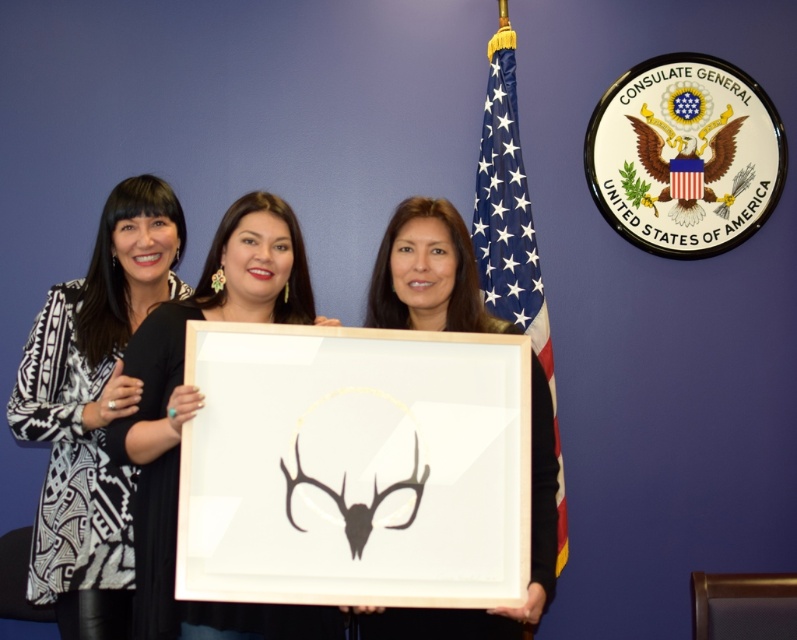
Question: Which point is closer to the camera?

Choices:
 (A) black matte deer head at center
 (B) american flag at center

Answer: (A)

Question: Is black printed fabric at left wider than matte black frame at center?

Choices:
 (A) yes
 (B) no

Answer: (A)

Question: Observing the image, what is the correct spatial positioning of matte black frame at center in reference to black matte deer head at center?

Choices:
 (A) below
 (B) above

Answer: (B)

Question: Which object is positioned closest to the black printed fabric at left?

Choices:
 (A) american flag at center
 (B) matte black frame at center

Answer: (B)

Question: Estimate the real-world distances between objects in this image. Which object is farther from the matte black frame at center?

Choices:
 (A) black printed fabric at left
 (B) black matte deer head at center

Answer: (A)

Question: Can you confirm if black printed fabric at left is positioned below black matte deer head at center?

Choices:
 (A) no
 (B) yes

Answer: (A)